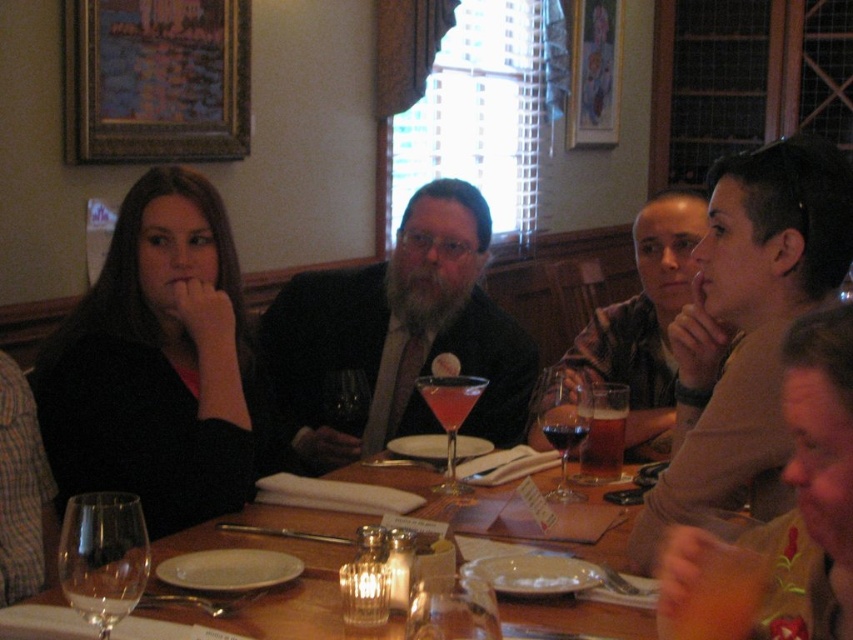
Does clear glass wine at table center have a greater height compared to translucent glass beverage at center?

Indeed, clear glass wine at table center has a greater height compared to translucent glass beverage at center.

Which of these two, clear glass wine at table center or translucent glass beverage at center, stands taller?

With more height is clear glass wine at table center.

The width and height of the screenshot is (853, 640). In order to click on clear glass wine at table center in this screenshot , I will do `click(102, 602)`.

Who is positioned more to the left, translucent glass martini glass at center or clear glass wine at table center?

Positioned to the left is clear glass wine at table center.

Is the position of translucent glass martini glass at center less distant than that of clear glass wine at table center?

That is False.

Who is more forward, (434,400) or (122,596)?

Point (122,596)

Where is `translucent glass martini glass at center`? This screenshot has height=640, width=853. translucent glass martini glass at center is located at coordinates (450, 416).

At what (x,y) coordinates should I click in order to perform the action: click on matte black shirt at left. Please return your answer as a coordinate pair (x, y). Image resolution: width=853 pixels, height=640 pixels. Looking at the image, I should click on (158, 364).

This screenshot has height=640, width=853. Identify the location of matte black shirt at left. (158, 364).